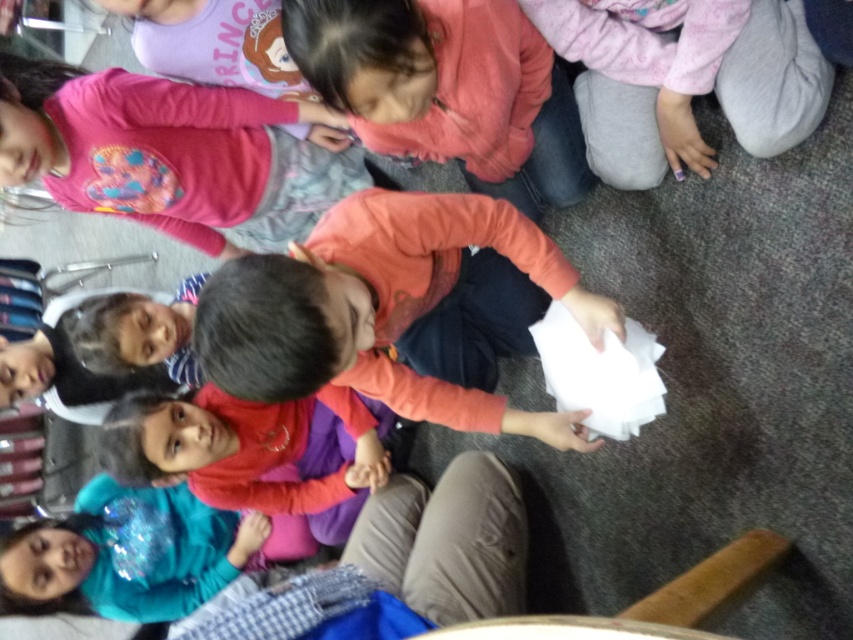
You are a teacher observing the classroom scene. You notice the matte pink sweater at center and the teal glitter shirt at lower left. Which child is positioned higher in the image?

The matte pink sweater at center is positioned higher than the teal glitter shirt at lower left in the image.

You are a teacher observing the children in the classroom. You notice two children wearing pink shirts. One has a pink fleece shirt at upper left and another has a matte pink shirt at center. Which child is wearing a smaller sized pink shirt?

The pink fleece shirt at upper left has a smaller size compared to the matte pink shirt at center, so the child wearing the pink fleece shirt at upper left is the one with the smaller sized pink shirt.